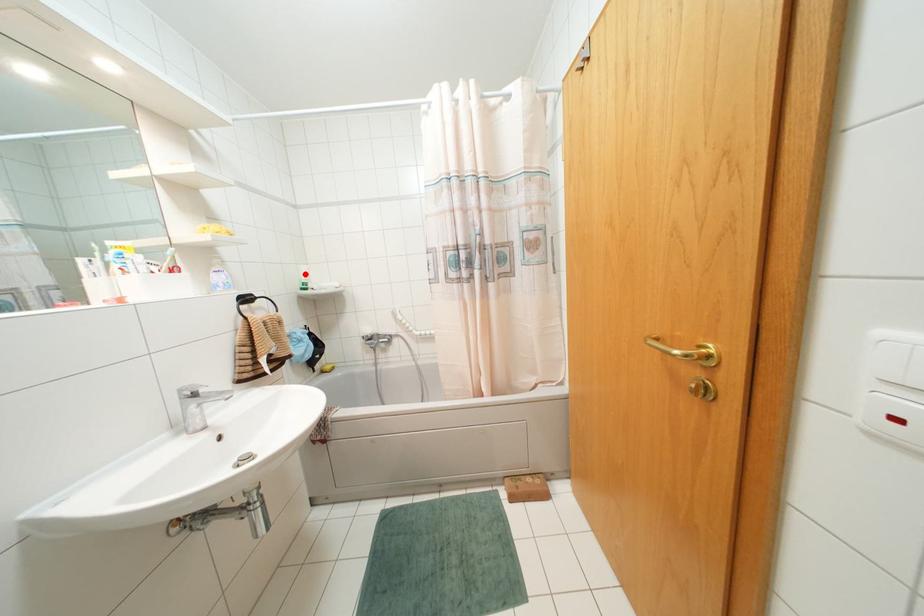
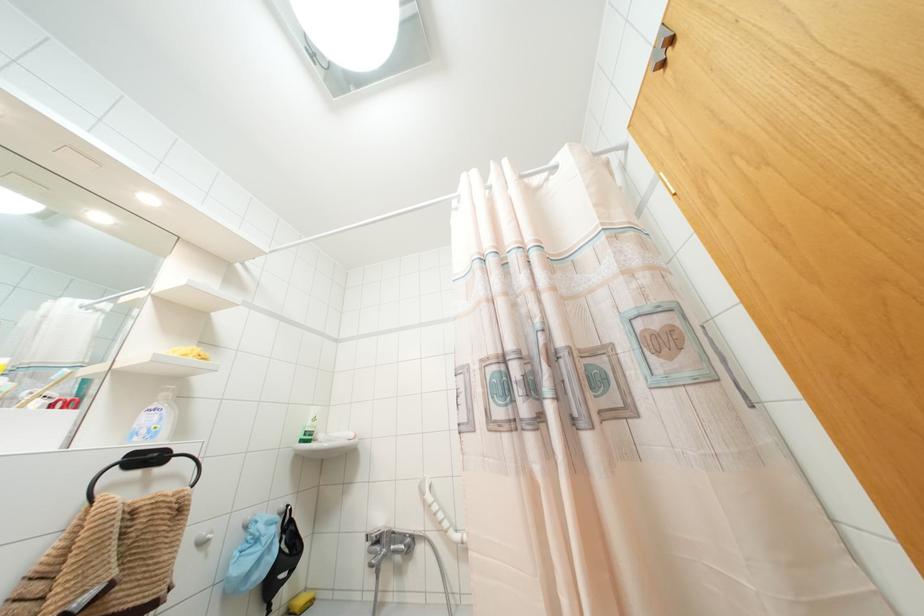
Locate, in the second image, the point that corresponds to the highlighted location in the first image.

(312, 419)